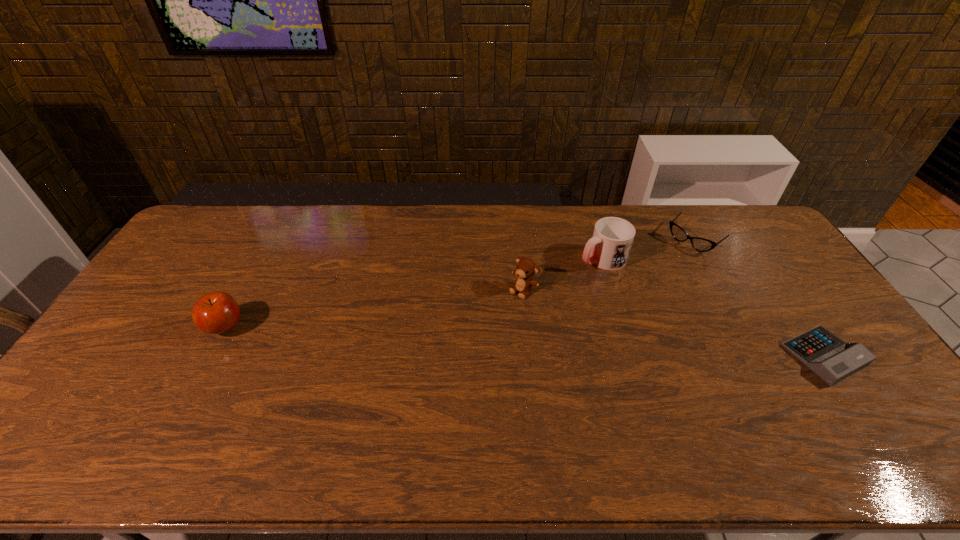
The width and height of the screenshot is (960, 540). In order to click on vacant space on the desktop that is between the leftmost object and the shortest object and is positioned on the side of the mug with the handle in this screenshot , I will do `click(440, 338)`.

The width and height of the screenshot is (960, 540). I want to click on vacant space on the desktop that is between the apple and the shortest object and is positioned on the front-facing side of the spectacles, so 576,343.

Locate an element on the screen. vacant space on the desktop that is between the apple and the shortest object and is positioned on the face of the teddy bear is located at coordinates (470, 339).